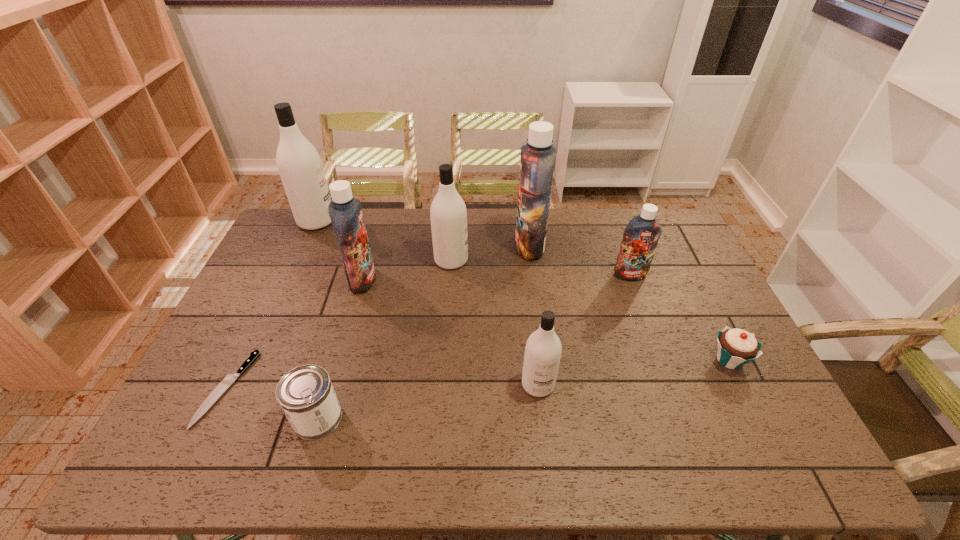
In order to click on blank region between the leftmost white shampoo and the teal cupcake in this screenshot , I will do `click(523, 291)`.

You are a GUI agent. You are given a task and a screenshot of the screen. Output one action in this format:
    pyautogui.click(x=<x>, y=<y>)
    Task: Click on the blank region between the rightmost shampoo and the can
    Image resolution: width=960 pixels, height=540 pixels.
    Given the screenshot: What is the action you would take?
    pyautogui.click(x=473, y=346)

At what (x,y) coordinates should I click in order to perform the action: click on vacant point located between the fifth object from left to right and the third shortest object. Please return your answer as a coordinate pair (x, y). The height and width of the screenshot is (540, 960). Looking at the image, I should click on (384, 339).

Find the location of a particular element. The width and height of the screenshot is (960, 540). empty space that is in between the can and the smallest blue shampoo is located at coordinates (473, 346).

Image resolution: width=960 pixels, height=540 pixels. In order to click on free spot between the steak knife and the second smallest blue shampoo in this screenshot , I will do `click(295, 334)`.

Locate an element on the screen. free area in between the farthest white shampoo and the second blue shampoo from left to right is located at coordinates (423, 233).

In order to click on free space between the second white shampoo from left to right and the farthest white shampoo in this screenshot , I will do `click(384, 240)`.

Identify which object is located as the seventh nearest to the leftmost blue shampoo. Please provide its 2D coordinates. Your answer should be formatted as a tuple, i.e. [(x, y)], where the tuple contains the x and y coordinates of a point satisfying the conditions above.

[(640, 238)]

The image size is (960, 540). I want to click on object that is the closest one to the rightmost shampoo, so [537, 163].

Where is `shampoo that stands as the fourth closest to the second blue shampoo from right to left`? shampoo that stands as the fourth closest to the second blue shampoo from right to left is located at coordinates (345, 211).